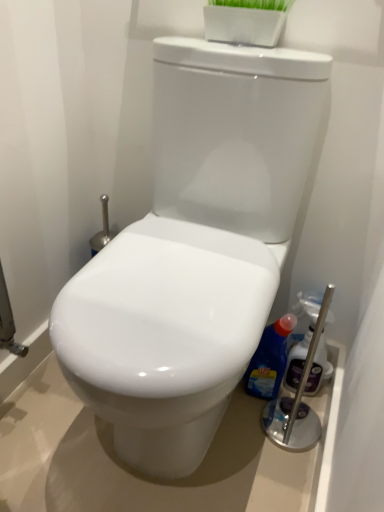
At what (x,y) coordinates should I click in order to perform the action: click on blue glossy bottle at right, placed as the 2th cleaning product when sorted from right to left. Please return your answer as a coordinate pair (x, y). This screenshot has width=384, height=512. Looking at the image, I should click on (270, 359).

This screenshot has height=512, width=384. Identify the location of blue glossy bottle at right, placed as the 2th cleaning product when sorted from right to left. (270, 359).

From a real-world perspective, between translucent plastic spray bottle at right, which is counted as the first cleaning product, starting from the right, and blue glossy bottle at right, positioned as the first cleaning product in left-to-right order, who is vertically lower?

In real-world perspective, blue glossy bottle at right, positioned as the first cleaning product in left-to-right order, is lower.

Can you tell me how much translucent plastic spray bottle at right, which is counted as the first cleaning product, starting from the right, and blue glossy bottle at right, positioned as the first cleaning product in left-to-right order, differ in facing direction?

1.23 degrees.

Is translucent plastic spray bottle at right, which is counted as the first cleaning product, starting from the right, bigger than blue glossy bottle at right, placed as the 2th cleaning product when sorted from right to left?

No.

Looking at this image, which is more to the left, translucent plastic spray bottle at right, the second cleaning product in the left-to-right sequence, or blue glossy bottle at right, positioned as the first cleaning product in left-to-right order?

Positioned to the left is blue glossy bottle at right, positioned as the first cleaning product in left-to-right order.

From a real-world perspective, is white glossy toilet at center over translucent plastic spray bottle at right, which is counted as the first cleaning product, starting from the right?

Yes, from a real-world perspective, white glossy toilet at center is on top of translucent plastic spray bottle at right, which is counted as the first cleaning product, starting from the right.

Is white glossy toilet at center aimed at translucent plastic spray bottle at right, the second cleaning product in the left-to-right sequence?

No, white glossy toilet at center is not facing towards translucent plastic spray bottle at right, the second cleaning product in the left-to-right sequence.

Which object is further away from the camera taking this photo, white glossy toilet at center or translucent plastic spray bottle at right, the second cleaning product in the left-to-right sequence?

translucent plastic spray bottle at right, the second cleaning product in the left-to-right sequence, is more distant.

In the image, is white glossy toilet at center on the left side or the right side of translucent plastic spray bottle at right, which is counted as the first cleaning product, starting from the right?

white glossy toilet at center is to the left of translucent plastic spray bottle at right, which is counted as the first cleaning product, starting from the right.

From a real-world perspective, is white glossy toilet at center positioned over blue glossy bottle at right, placed as the 2th cleaning product when sorted from right to left, based on gravity?

Yes, from a real-world perspective, white glossy toilet at center is over blue glossy bottle at right, placed as the 2th cleaning product when sorted from right to left

Which object is more forward, white glossy toilet at center or blue glossy bottle at right, placed as the 2th cleaning product when sorted from right to left?

white glossy toilet at center is in front.

Between white glossy toilet at center and blue glossy bottle at right, positioned as the first cleaning product in left-to-right order, which one has smaller size?

blue glossy bottle at right, positioned as the first cleaning product in left-to-right order.

Which is in front, point (261, 180) or point (274, 340)?

The point (261, 180) is closer to the camera.

From the picture: Is translucent plastic spray bottle at right, the second cleaning product in the left-to-right sequence, directly adjacent to white glossy toilet at center?

No, translucent plastic spray bottle at right, the second cleaning product in the left-to-right sequence, is not making contact with white glossy toilet at center.

In the scene shown: From a real-world perspective, is translucent plastic spray bottle at right, which is counted as the first cleaning product, starting from the right, positioned above or below white glossy toilet at center?

translucent plastic spray bottle at right, which is counted as the first cleaning product, starting from the right, is below white glossy toilet at center.

From the image's perspective, is translucent plastic spray bottle at right, the second cleaning product in the left-to-right sequence, located above white glossy toilet at center?

Actually, translucent plastic spray bottle at right, the second cleaning product in the left-to-right sequence, appears below white glossy toilet at center in the image.

Can you confirm if blue glossy bottle at right, placed as the 2th cleaning product when sorted from right to left, is taller than white glossy toilet at center?

No.

This screenshot has height=512, width=384. I want to click on toilet lying on the left of blue glossy bottle at right, positioned as the first cleaning product in left-to-right order, so click(194, 250).

Who is smaller, blue glossy bottle at right, placed as the 2th cleaning product when sorted from right to left, or white glossy toilet at center?

blue glossy bottle at right, placed as the 2th cleaning product when sorted from right to left.

Would you say blue glossy bottle at right, placed as the 2th cleaning product when sorted from right to left, contains white glossy toilet at center?

Actually, white glossy toilet at center is outside blue glossy bottle at right, placed as the 2th cleaning product when sorted from right to left.

From the image's perspective, is blue glossy bottle at right, placed as the 2th cleaning product when sorted from right to left, located above or below translucent plastic spray bottle at right, which is counted as the first cleaning product, starting from the right?

blue glossy bottle at right, placed as the 2th cleaning product when sorted from right to left, is below translucent plastic spray bottle at right, which is counted as the first cleaning product, starting from the right.

Which is correct: blue glossy bottle at right, placed as the 2th cleaning product when sorted from right to left, is inside translucent plastic spray bottle at right, the second cleaning product in the left-to-right sequence, or outside of it?

blue glossy bottle at right, placed as the 2th cleaning product when sorted from right to left, exists outside the volume of translucent plastic spray bottle at right, the second cleaning product in the left-to-right sequence.

Considering their positions, is blue glossy bottle at right, placed as the 2th cleaning product when sorted from right to left, located in front of or behind translucent plastic spray bottle at right, the second cleaning product in the left-to-right sequence?

Visually, blue glossy bottle at right, placed as the 2th cleaning product when sorted from right to left, is located behind translucent plastic spray bottle at right, the second cleaning product in the left-to-right sequence.

Find the location of `cleaning product beneath the translucent plastic spray bottle at right, the second cleaning product in the left-to-right sequence (from a real-world perspective)`. cleaning product beneath the translucent plastic spray bottle at right, the second cleaning product in the left-to-right sequence (from a real-world perspective) is located at coordinates (270, 359).

From the image's perspective, count 1st cleaning products downward from the white glossy toilet at center and point to it. Please provide its 2D coordinates.

[(308, 350)]

From the image, which object appears to be nearer to white glossy toilet at center, translucent plastic spray bottle at right, the second cleaning product in the left-to-right sequence, or blue glossy bottle at right, placed as the 2th cleaning product when sorted from right to left?

Based on the image, blue glossy bottle at right, placed as the 2th cleaning product when sorted from right to left, appears to be nearer to white glossy toilet at center.

Based on their spatial positions, is translucent plastic spray bottle at right, which is counted as the first cleaning product, starting from the right, or white glossy toilet at center closer to blue glossy bottle at right, placed as the 2th cleaning product when sorted from right to left?

translucent plastic spray bottle at right, which is counted as the first cleaning product, starting from the right, lies closer to blue glossy bottle at right, placed as the 2th cleaning product when sorted from right to left, than the other object.

From the image, which object appears to be nearer to translucent plastic spray bottle at right, the second cleaning product in the left-to-right sequence, white glossy toilet at center or blue glossy bottle at right, positioned as the first cleaning product in left-to-right order?

Among the two, blue glossy bottle at right, positioned as the first cleaning product in left-to-right order, is located nearer to translucent plastic spray bottle at right, the second cleaning product in the left-to-right sequence.

Estimate the real-world distances between objects in this image. Which object is further from blue glossy bottle at right, positioned as the first cleaning product in left-to-right order, white glossy toilet at center or translucent plastic spray bottle at right, the second cleaning product in the left-to-right sequence?

white glossy toilet at center.

Estimate the real-world distances between objects in this image. Which object is closer to white glossy toilet at center, blue glossy bottle at right, placed as the 2th cleaning product when sorted from right to left, or translucent plastic spray bottle at right, which is counted as the first cleaning product, starting from the right?

blue glossy bottle at right, placed as the 2th cleaning product when sorted from right to left, is positioned closer to the anchor white glossy toilet at center.

Estimate the real-world distances between objects in this image. Which object is closer to translucent plastic spray bottle at right, which is counted as the first cleaning product, starting from the right, blue glossy bottle at right, placed as the 2th cleaning product when sorted from right to left, or white glossy toilet at center?

Among the two, blue glossy bottle at right, placed as the 2th cleaning product when sorted from right to left, is located nearer to translucent plastic spray bottle at right, which is counted as the first cleaning product, starting from the right.

Image resolution: width=384 pixels, height=512 pixels. Identify the location of cleaning product between white glossy toilet at center and blue glossy bottle at right, positioned as the first cleaning product in left-to-right order, from front to back. (308, 350).